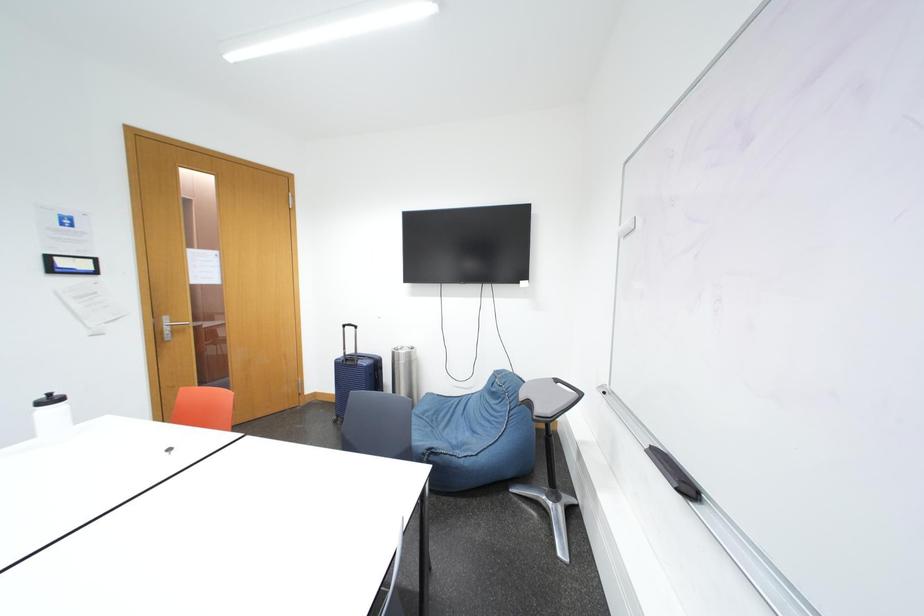
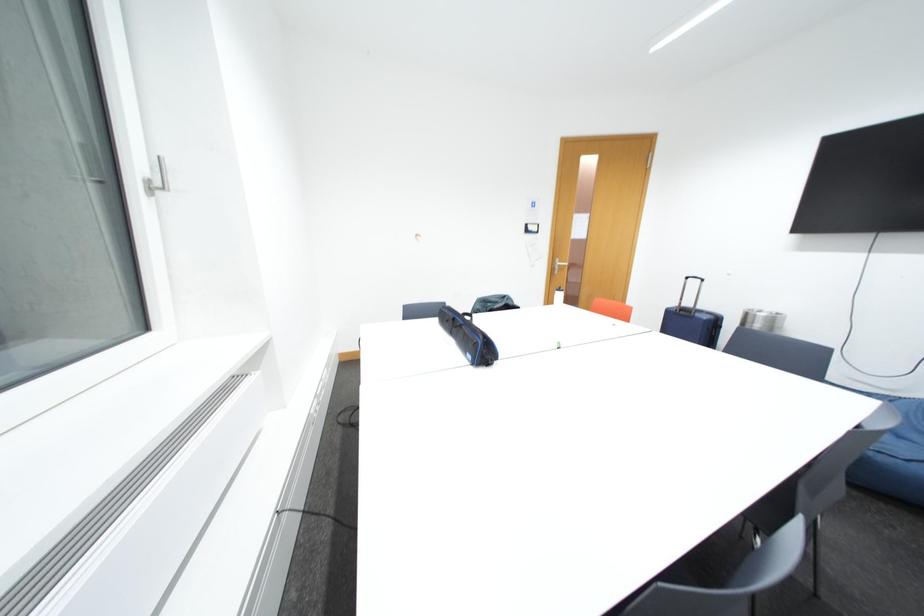
Question: The camera is either moving clockwise (left) or counter-clockwise (right) around the object. The first image is from the beginning of the video and the second image is from the end. Is the camera moving left or right when shooting the video?

Choices:
 (A) Left
 (B) Right

Answer: (B)